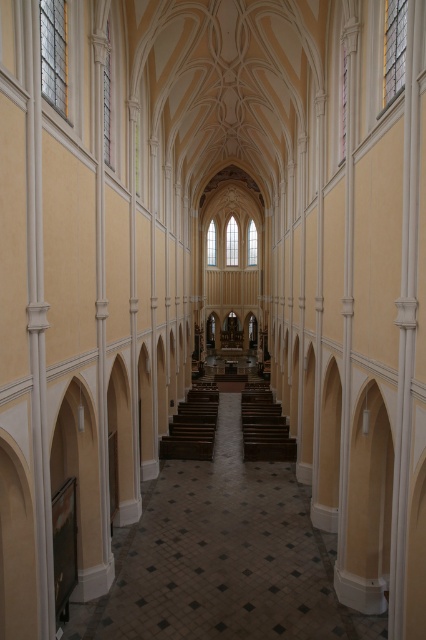
Question: Can you confirm if brown polished wood stairs at center is positioned to the left of brown wooden stairs at center?

Choices:
 (A) yes
 (B) no

Answer: (A)

Question: Where is brown polished wood stairs at center located in relation to brown wooden stairs at center in the image?

Choices:
 (A) below
 (B) above

Answer: (A)

Question: Which point appears closest to the camera in this image?

Choices:
 (A) (206, 419)
 (B) (285, 448)

Answer: (B)

Question: Observing the image, what is the correct spatial positioning of brown polished wood stairs at center in reference to brown wooden stairs at center?

Choices:
 (A) right
 (B) left

Answer: (B)

Question: Which of the following is the farthest from the observer?

Choices:
 (A) brown wooden stairs at center
 (B) brown polished wood stairs at center

Answer: (B)